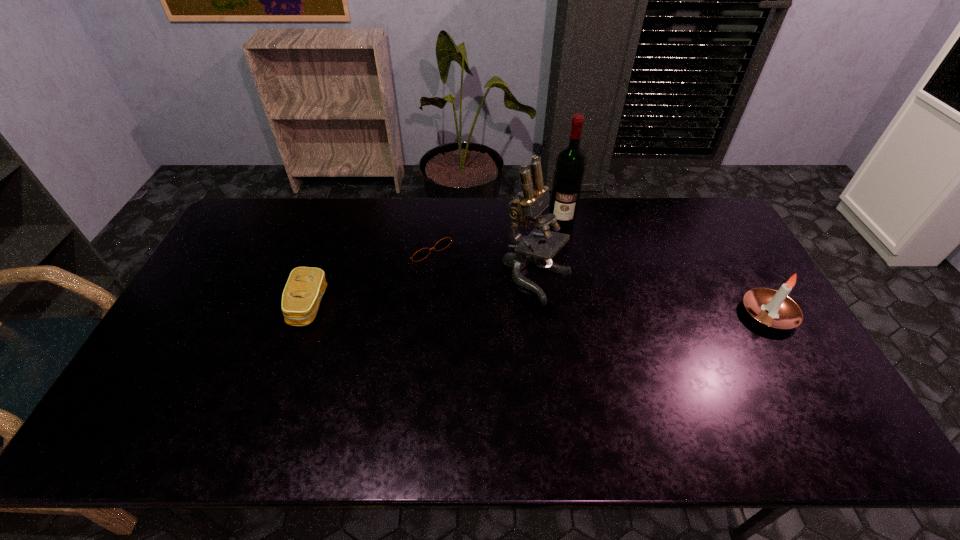
Select which object is the fourth closest to the microscope. Please provide its 2D coordinates. Your answer should be formatted as a tuple, i.e. [(x, y)], where the tuple contains the x and y coordinates of a point satisfying the conditions above.

[(305, 287)]

You are a GUI agent. You are given a task and a screenshot of the screen. Output one action in this format:
    pyautogui.click(x=<x>, y=<y>)
    Task: Click on the free region that satisfies the following two spatial constraints: 1. on the front side of the third shortest object; 2. on the right side of the microscope
    
    Given the screenshot: What is the action you would take?
    pyautogui.click(x=542, y=314)

Locate an element on the screen. free spot that satisfies the following two spatial constraints: 1. on the back side of the alcohol; 2. on the right side of the fourth object from right to left is located at coordinates (427, 219).

Find the location of `vacant region that satisfies the following two spatial constraints: 1. on the front side of the alcohol; 2. on the left side of the rightmost object`. vacant region that satisfies the following two spatial constraints: 1. on the front side of the alcohol; 2. on the left side of the rightmost object is located at coordinates (581, 314).